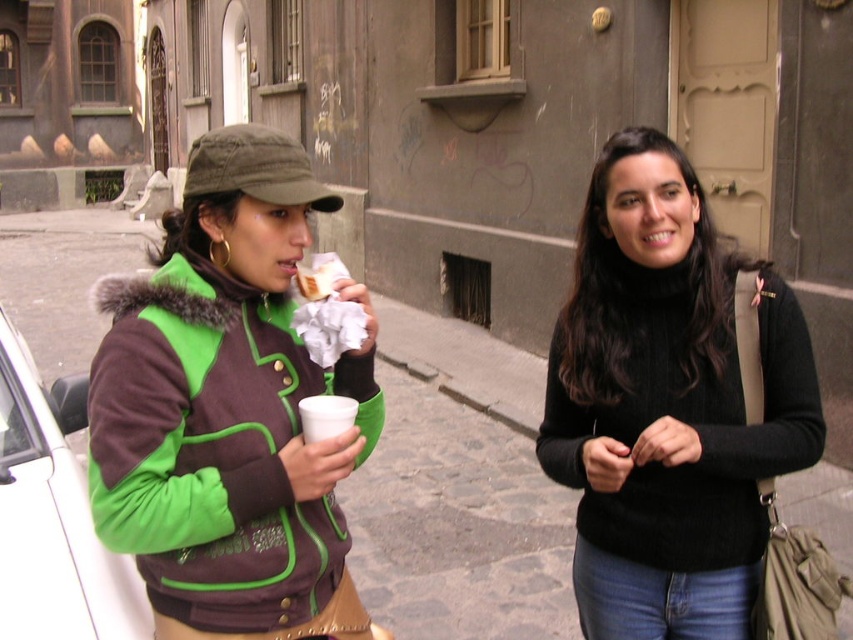
Question: Is black turtleneck sweater at center to the right of white matte cup at center from the viewer's perspective?

Choices:
 (A) no
 (B) yes

Answer: (B)

Question: Estimate the real-world distances between objects in this image. Which object is closer to the green fuzzy jacket at left?

Choices:
 (A) white matte cup at center
 (B) white paper cup at center

Answer: (A)

Question: Where is black knit sweater at center located in relation to white matte car at left in the image?

Choices:
 (A) right
 (B) left

Answer: (A)

Question: Which point is closer to the camera?

Choices:
 (A) green fuzzy jacket at left
 (B) white matte cup at center

Answer: (A)

Question: Which object appears farthest from the camera in this image?

Choices:
 (A) white paper cup at center
 (B) white matte cup at center
 (C) black knit sweater at center

Answer: (A)

Question: Is black knit sweater at center to the left of white matte cup at center from the viewer's perspective?

Choices:
 (A) no
 (B) yes

Answer: (A)